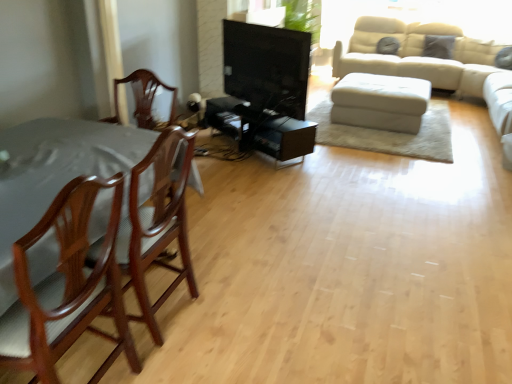
Question: Does mahogany wood chair at left, which is the first chair from back to front, appear on the left side of white leather ottoman at center?

Choices:
 (A) no
 (B) yes

Answer: (B)

Question: Considering the relative sizes of mahogany wood chair at left, the second chair viewed from the front, and white leather ottoman at center in the image provided, is mahogany wood chair at left, the second chair viewed from the front, wider than white leather ottoman at center?

Choices:
 (A) yes
 (B) no

Answer: (B)

Question: From a real-world perspective, is mahogany wood chair at left, which is the first chair from back to front, located higher than white leather ottoman at center?

Choices:
 (A) yes
 (B) no

Answer: (A)

Question: Is mahogany wood chair at left, the second chair viewed from the front, smaller than white leather ottoman at center?

Choices:
 (A) no
 (B) yes

Answer: (B)

Question: From the image's perspective, is mahogany wood chair at left, the second chair viewed from the front, above white leather ottoman at center?

Choices:
 (A) yes
 (B) no

Answer: (B)

Question: From a real-world perspective, is black glossy tv stand at center physically located above or below white leather ottoman at center?

Choices:
 (A) above
 (B) below

Answer: (A)

Question: Would you say black glossy tv stand at center is inside or outside white leather ottoman at center?

Choices:
 (A) outside
 (B) inside

Answer: (A)

Question: Is black glossy tv stand at center in front of or behind white leather ottoman at center in the image?

Choices:
 (A) behind
 (B) front

Answer: (B)

Question: Considering the positions of black glossy tv stand at center and white leather ottoman at center in the image, is black glossy tv stand at center bigger or smaller than white leather ottoman at center?

Choices:
 (A) small
 (B) big

Answer: (A)

Question: From their relative heights in the image, would you say mahogany wood chair at left, the second chair positioned from the back, is taller or shorter than white leather ottoman at center?

Choices:
 (A) short
 (B) tall

Answer: (B)

Question: Looking at their shapes, would you say mahogany wood chair at left, the first chair positioned from the front, is wider or thinner than white leather ottoman at center?

Choices:
 (A) wide
 (B) thin

Answer: (B)

Question: From a real-world perspective, is mahogany wood chair at left, the second chair positioned from the back, physically located above or below white leather ottoman at center?

Choices:
 (A) below
 (B) above

Answer: (B)

Question: Is point [90, 203] positioned closer to the camera than point [345, 124]?

Choices:
 (A) farther
 (B) closer

Answer: (B)

Question: In the image, is white leather ottoman at center positioned in front of or behind mahogany wood chair at left, the second chair positioned from the back?

Choices:
 (A) behind
 (B) front

Answer: (A)

Question: Would you say white leather ottoman at center is inside or outside mahogany wood chair at left, the second chair positioned from the back?

Choices:
 (A) outside
 (B) inside

Answer: (A)